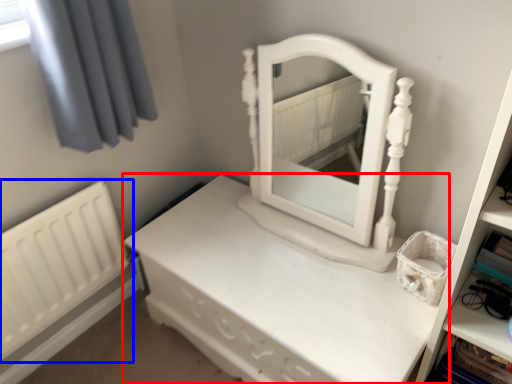
Question: Among these objects, which one is farthest to the camera, nightstand (highlighted by a red box) or radiator (highlighted by a blue box)?

Choices:
 (A) nightstand
 (B) radiator

Answer: (B)